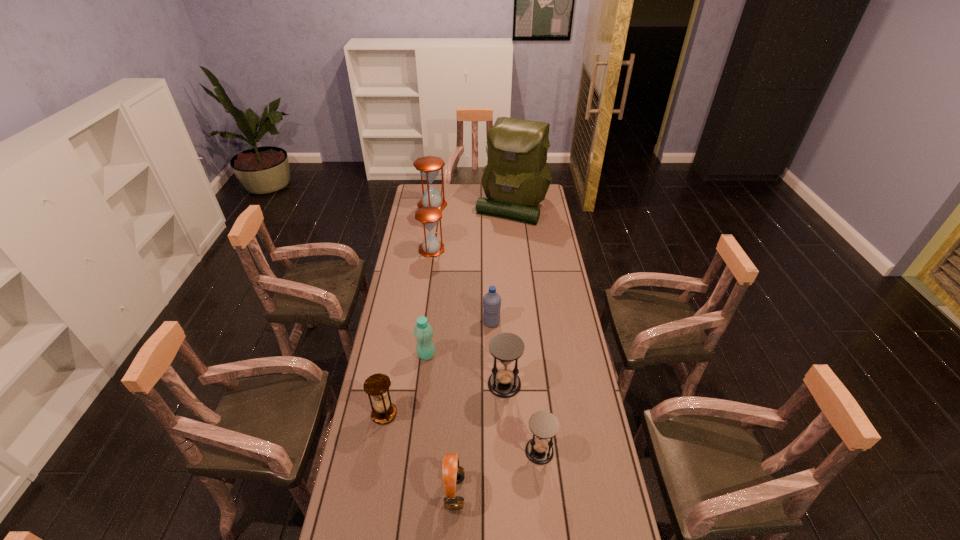
Where is `vacant space located on the left of the sixth farthest object`? vacant space located on the left of the sixth farthest object is located at coordinates (392, 384).

Locate an element on the screen. The width and height of the screenshot is (960, 540). free region located 0.180m on the right of the sixth nearest object is located at coordinates (542, 322).

Locate an element on the screen. This screenshot has width=960, height=540. free space located 0.180m on the back of the bottle is located at coordinates click(431, 315).

Image resolution: width=960 pixels, height=540 pixels. I want to click on free spot located 0.260m on the front of the smallest brown hourglass, so coord(368,504).

Find the location of a particular element. The height and width of the screenshot is (540, 960). vacant region located on the ear cups of the fifth object from right to left is located at coordinates (x=592, y=492).

In order to click on free space located 0.380m on the left of the smaller black hourglass in this screenshot , I will do `click(410, 451)`.

Where is `backpack located in the far edge section of the desktop`? The height and width of the screenshot is (540, 960). backpack located in the far edge section of the desktop is located at coordinates (516, 178).

I want to click on hourglass that is at the far edge, so click(429, 166).

This screenshot has height=540, width=960. In order to click on bottle located in the left edge section of the desktop in this screenshot , I will do click(423, 332).

The width and height of the screenshot is (960, 540). What are the coordinates of `object that is at the right edge` in the screenshot? It's located at (516, 178).